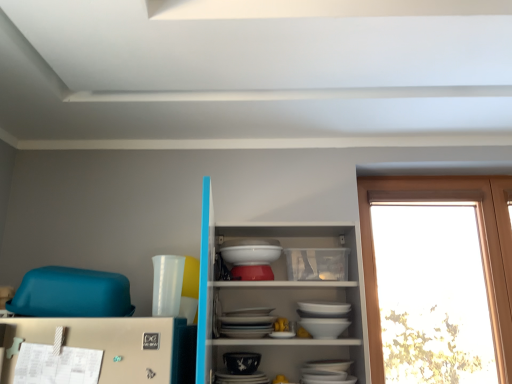
Question: Is transparent glass window at right facing towards porcelain bowl at center?

Choices:
 (A) yes
 (B) no

Answer: (B)

Question: From a real-world perspective, is transparent glass window at right on top of porcelain bowl at center?

Choices:
 (A) yes
 (B) no

Answer: (A)

Question: Can we say transparent glass window at right lies outside porcelain bowl at center?

Choices:
 (A) no
 (B) yes

Answer: (B)

Question: Considering the relative sizes of transparent glass window at right and porcelain bowl at center in the image provided, is transparent glass window at right bigger than porcelain bowl at center?

Choices:
 (A) yes
 (B) no

Answer: (A)

Question: From the image's perspective, would you say transparent glass window at right is positioned over porcelain bowl at center?

Choices:
 (A) yes
 (B) no

Answer: (A)

Question: Is transparent glass window at right taller or shorter than white glossy bowls at center?

Choices:
 (A) short
 (B) tall

Answer: (B)

Question: Is transparent glass window at right to the left or to the right of white glossy bowls at center in the image?

Choices:
 (A) left
 (B) right

Answer: (B)

Question: From a real-world perspective, is transparent glass window at right positioned above or below white glossy bowls at center?

Choices:
 (A) above
 (B) below

Answer: (A)

Question: Is point (455, 180) closer or farther from the camera than point (259, 336)?

Choices:
 (A) farther
 (B) closer

Answer: (A)

Question: From the image's perspective, is transparent glass window at right above or below porcelain bowl at center?

Choices:
 (A) below
 (B) above

Answer: (B)

Question: Considering the positions of transparent glass window at right and porcelain bowl at center in the image, is transparent glass window at right bigger or smaller than porcelain bowl at center?

Choices:
 (A) small
 (B) big

Answer: (B)

Question: Considering the positions of transparent glass window at right and porcelain bowl at center in the image, is transparent glass window at right wider or thinner than porcelain bowl at center?

Choices:
 (A) thin
 (B) wide

Answer: (A)

Question: From a real-world perspective, relative to porcelain bowl at center, is transparent glass window at right vertically above or below?

Choices:
 (A) above
 (B) below

Answer: (A)

Question: From their relative heights in the image, would you say porcelain bowl at center is taller or shorter than white glossy bowl at center?

Choices:
 (A) short
 (B) tall

Answer: (A)

Question: Considering the positions of point (252, 367) and point (266, 248), is point (252, 367) closer or farther from the camera than point (266, 248)?

Choices:
 (A) farther
 (B) closer

Answer: (B)